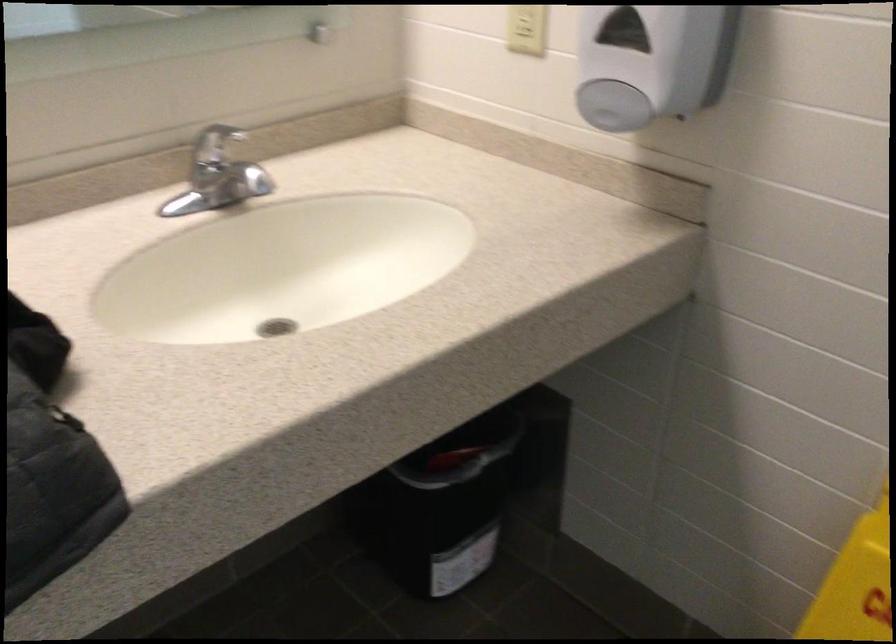
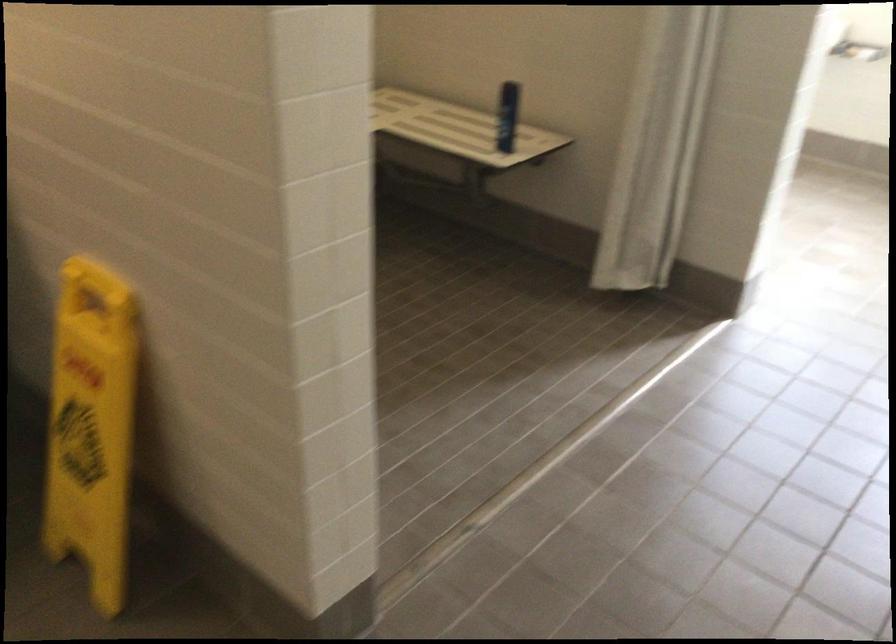
What movement of the cameraman would produce the second image?

The movement direction of the cameraman is right, backward.